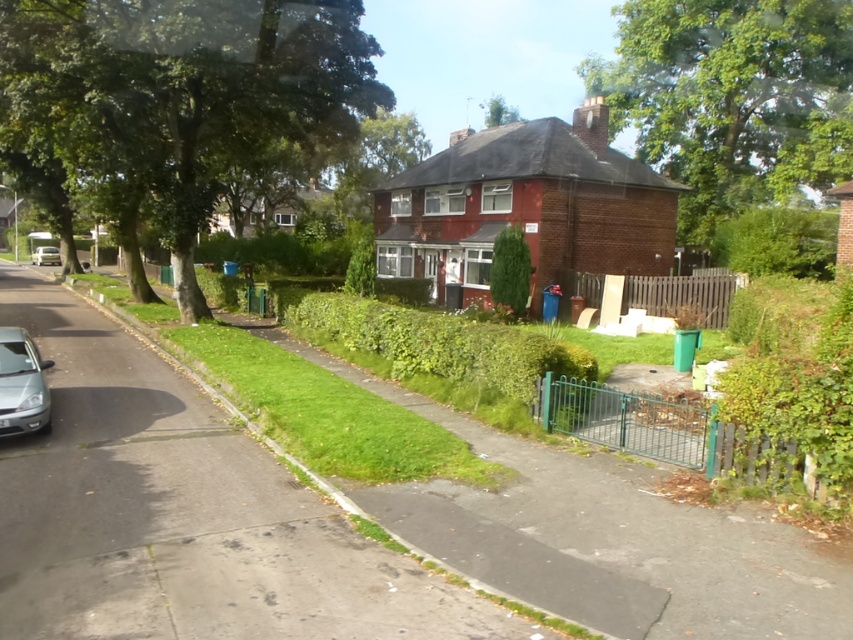
Question: Which object appears farthest from the camera in this image?

Choices:
 (A) silver metallic car at lower left
 (B) silver metallic car at left

Answer: (B)

Question: In this image, where is silver metallic car at lower left located relative to silver metallic car at left?

Choices:
 (A) left
 (B) right

Answer: (B)

Question: Which of the following is the farthest from the observer?

Choices:
 (A) silver metallic car at left
 (B) silver metallic car at lower left

Answer: (A)

Question: Considering the relative positions of silver metallic car at lower left and silver metallic car at left in the image provided, where is silver metallic car at lower left located with respect to silver metallic car at left?

Choices:
 (A) left
 (B) right

Answer: (B)

Question: Is silver metallic car at lower left wider than silver metallic car at left?

Choices:
 (A) yes
 (B) no

Answer: (A)

Question: Which point is farther to the camera?

Choices:
 (A) (44, 257)
 (B) (0, 381)

Answer: (A)